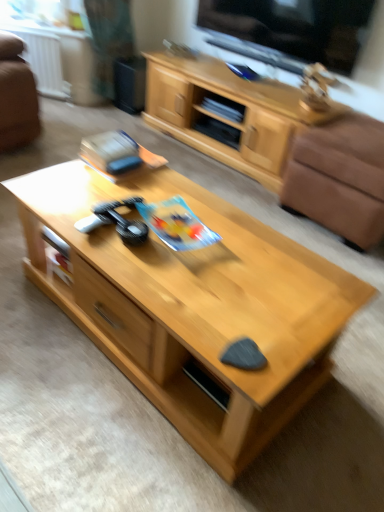
Question: Looking at the image, does white plastic radiator at upper left seem bigger or smaller compared to brown leather armchair at right?

Choices:
 (A) big
 (B) small

Answer: (B)

Question: From the image's perspective, is white plastic radiator at upper left positioned above or below brown leather armchair at right?

Choices:
 (A) below
 (B) above

Answer: (B)

Question: Considering the real-world distances, which object is farthest from the light wood cabinet at upper center?

Choices:
 (A) light wood coffee table at center
 (B) black glossy tv at upper center
 (C) white plastic radiator at upper left
 (D) brown leather armchair at right

Answer: (A)

Question: Estimate the real-world distances between objects in this image. Which object is closer to the light wood coffee table at center?

Choices:
 (A) black glossy tv at upper center
 (B) brown leather armchair at right
 (C) white plastic radiator at upper left
 (D) light wood cabinet at upper center

Answer: (B)